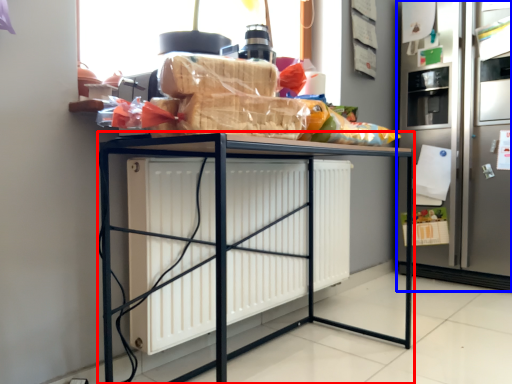
Question: Which object is closer to the camera taking this photo, furniture (highlighted by a red box) or fridge (highlighted by a blue box)?

Choices:
 (A) furniture
 (B) fridge

Answer: (A)